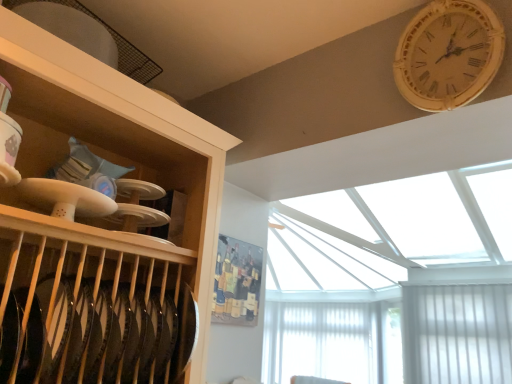
Question: Would you say white wooden clock at upper right is part of white sheer curtain at lower right's contents?

Choices:
 (A) no
 (B) yes

Answer: (A)

Question: From the image's perspective, is white sheer curtain at lower right located beneath white wooden clock at upper right?

Choices:
 (A) no
 (B) yes

Answer: (B)

Question: Is the depth of white sheer curtain at lower right greater than that of white wooden clock at upper right?

Choices:
 (A) yes
 (B) no

Answer: (A)

Question: Considering the relative sizes of white sheer curtain at lower right and white wooden clock at upper right in the image provided, is white sheer curtain at lower right thinner than white wooden clock at upper right?

Choices:
 (A) no
 (B) yes

Answer: (A)

Question: Can you see white sheer curtain at lower right touching white wooden clock at upper right?

Choices:
 (A) no
 (B) yes

Answer: (A)

Question: Considering the relative sizes of white sheer curtain at lower right and white wooden clock at upper right in the image provided, is white sheer curtain at lower right taller than white wooden clock at upper right?

Choices:
 (A) no
 (B) yes

Answer: (B)

Question: Can you confirm if white wooden clock at upper right is bigger than white sheer curtain at lower right?

Choices:
 (A) no
 (B) yes

Answer: (A)

Question: Is white wooden clock at upper right to the left of white sheer curtain at lower right from the viewer's perspective?

Choices:
 (A) no
 (B) yes

Answer: (B)

Question: Does white wooden clock at upper right lie in front of white sheer curtain at lower right?

Choices:
 (A) yes
 (B) no

Answer: (A)

Question: Would you say white wooden clock at upper right is a long distance from white sheer curtain at lower right?

Choices:
 (A) yes
 (B) no

Answer: (A)

Question: From a real-world perspective, is white wooden clock at upper right over white sheer curtain at lower right?

Choices:
 (A) no
 (B) yes

Answer: (B)

Question: Is white wooden clock at upper right looking in the opposite direction of white sheer curtain at lower right?

Choices:
 (A) yes
 (B) no

Answer: (B)

Question: In terms of width, does white wooden clock at upper right look wider or thinner when compared to white sheer curtain at lower right?

Choices:
 (A) wide
 (B) thin

Answer: (B)